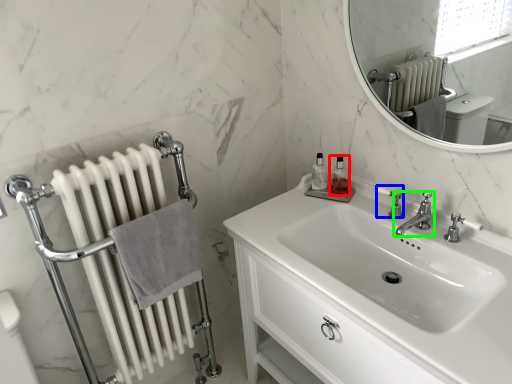
Question: Which object is the closest to the toiletry (highlighted by a red box)? Choose among these: plumbing fixture (highlighted by a blue box) or tap (highlighted by a green box).

Choices:
 (A) plumbing fixture
 (B) tap

Answer: (A)